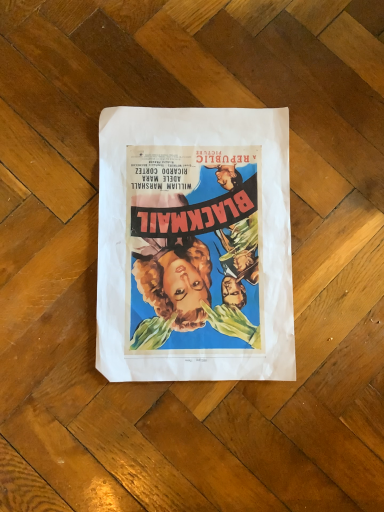
Identify the location of vacant area on top of matte paper poster at center (from a real-world perspective). The height and width of the screenshot is (512, 384). (211, 239).